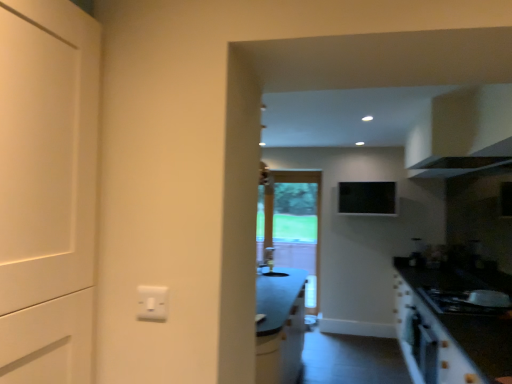
What is the approximate height of black matte gas stove at lower right?

2.29 inches.

I want to click on clear glass screen door at center, so click(x=292, y=225).

This screenshot has height=384, width=512. In order to click on black matte gas stove at lower right in this screenshot , I will do `click(467, 301)`.

Locate an element on the screen. sink located in front of the clear glass screen door at center is located at coordinates (271, 263).

Considering the relative sizes of white glossy sink at center and clear glass screen door at center in the image provided, is white glossy sink at center taller than clear glass screen door at center?

No.

Is white glossy sink at center wider or thinner than clear glass screen door at center?

In the image, white glossy sink at center appears to be wider than clear glass screen door at center.

Could you tell me if white glossy sink at center is facing clear glass screen door at center?

No, white glossy sink at center is not facing towards clear glass screen door at center.

Considering the relative positions of clear glass screen door at center and white glossy sink at center in the image provided, is clear glass screen door at center to the right of white glossy sink at center from the viewer's perspective?

Correct, you'll find clear glass screen door at center to the right of white glossy sink at center.

Between clear glass screen door at center and white glossy sink at center, which one is positioned behind?

clear glass screen door at center is behind.

Is clear glass screen door at center positioned with its back to white glossy sink at center?

No, clear glass screen door at center is not facing away from white glossy sink at center.

Which of these two, clear glass screen door at center or white glossy sink at center, is wider?

With larger width is white glossy sink at center.

Is white glossy sink at center outside of black matte gas stove at lower right?

Yes, white glossy sink at center is located beyond the bounds of black matte gas stove at lower right.

In terms of width, does white glossy sink at center look wider or thinner when compared to black matte gas stove at lower right?

white glossy sink at center is thinner than black matte gas stove at lower right.

Is white glossy sink at center turned away from black matte gas stove at lower right?

No, black matte gas stove at lower right is not at the back of white glossy sink at center.

Which object is further away from the camera taking this photo, white glossy cabinet at upper right or black matte gas stove at lower right?

black matte gas stove at lower right is more distant.

What are the coordinates of `gas stove that appears below the white glossy cabinet at upper right (from a real-world perspective)` in the screenshot? It's located at [467, 301].

Which is farther, (466, 164) or (511, 305)?

The point (511, 305) is farther.

Consider the image. Is white glossy cabinet at upper right placed right next to black matte gas stove at lower right?

No, white glossy cabinet at upper right is not beside black matte gas stove at lower right.

In terms of width, does white glossy cabinet at upper right look wider or thinner when compared to white glossy sink at center?

Clearly, white glossy cabinet at upper right has more width compared to white glossy sink at center.

Measure the distance between white glossy cabinet at upper right and white glossy sink at center.

white glossy cabinet at upper right and white glossy sink at center are 8.34 feet apart from each other.

From a real-world perspective, is white glossy cabinet at upper right over white glossy sink at center?

Correct, in the physical world, white glossy cabinet at upper right is higher than white glossy sink at center.

What's the angular difference between white glossy cabinet at upper right and white glossy sink at center's facing directions?

The facing directions of white glossy cabinet at upper right and white glossy sink at center are 139 degrees apart.

From the image's perspective, is black matte gas stove at lower right positioned above or below clear glass screen door at center?

Based on their image positions, black matte gas stove at lower right is located beneath clear glass screen door at center.

Is black matte gas stove at lower right smaller than clear glass screen door at center?

Indeed, black matte gas stove at lower right has a smaller size compared to clear glass screen door at center.

Considering the relative sizes of white glossy cabinet at upper right and clear glass screen door at center in the image provided, is white glossy cabinet at upper right shorter than clear glass screen door at center?

Yes.

Which of these two, white glossy cabinet at upper right or clear glass screen door at center, is wider?

white glossy cabinet at upper right.

Can we say white glossy cabinet at upper right lies outside clear glass screen door at center?

Absolutely, white glossy cabinet at upper right is external to clear glass screen door at center.

What's the angular difference between white glossy cabinet at upper right and clear glass screen door at center's facing directions?

They differ by 89.8 degrees in their facing directions.

Locate an element on the screen. This screenshot has width=512, height=384. sink above the clear glass screen door at center (from the image's perspective) is located at coordinates (271, 263).

The width and height of the screenshot is (512, 384). Identify the location of sink below the clear glass screen door at center (from a real-world perspective). (271, 263).

Considering their positions, is white glossy cabinet at upper right positioned further to white glossy sink at center than clear glass screen door at center?

white glossy cabinet at upper right is further to white glossy sink at center.

Looking at the image, which one is located further to black matte gas stove at lower right, clear glass screen door at center or white glossy sink at center?

clear glass screen door at center.

Looking at the image, which one is located further to black matte gas stove at lower right, clear glass screen door at center or white glossy cabinet at upper right?

The object further to black matte gas stove at lower right is clear glass screen door at center.

Looking at the image, which one is located closer to black matte gas stove at lower right, white glossy cabinet at upper right or white glossy sink at center?

The object closer to black matte gas stove at lower right is white glossy cabinet at upper right.

When comparing their distances from white glossy sink at center, does clear glass screen door at center or black matte gas stove at lower right seem closer?

clear glass screen door at center lies closer to white glossy sink at center than the other object.

Which object lies nearer to the anchor point white glossy cabinet at upper right, white glossy sink at center or black matte gas stove at lower right?

Among the two, black matte gas stove at lower right is located nearer to white glossy cabinet at upper right.

Estimate the real-world distances between objects in this image. Which object is further from black matte gas stove at lower right, white glossy sink at center or clear glass screen door at center?

clear glass screen door at center is positioned further to the anchor black matte gas stove at lower right.

Estimate the real-world distances between objects in this image. Which object is further from clear glass screen door at center, white glossy sink at center or black matte gas stove at lower right?

Among the two, black matte gas stove at lower right is located further to clear glass screen door at center.

In order to click on sink between black matte gas stove at lower right and clear glass screen door at center in the front-back direction in this screenshot , I will do `click(271, 263)`.

The height and width of the screenshot is (384, 512). I want to click on gas stove located between white glossy cabinet at upper right and white glossy sink at center in the depth direction, so click(x=467, y=301).

Image resolution: width=512 pixels, height=384 pixels. What are the coordinates of `gas stove between white glossy cabinet at upper right and clear glass screen door at center along the z-axis` in the screenshot? It's located at (467, 301).

Find the location of a particular element. Image resolution: width=512 pixels, height=384 pixels. sink between white glossy cabinet at upper right and clear glass screen door at center in the front-back direction is located at coordinates (271, 263).